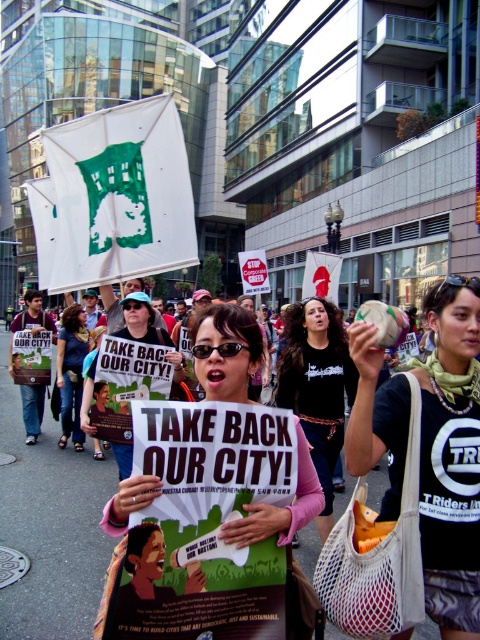
Which is above, black cotton shirt at center or matte black sign at center?

matte black sign at center is above.

Between point (291, 323) and point (95, 358), which one is positioned behind?

Point (95, 358)

Which is behind, point (280, 374) or point (122, 333)?

Positioned behind is point (122, 333).

At what (x,y) coordinates should I click in order to perform the action: click on black cotton shirt at center. Please return your answer as a coordinate pair (x, y). This screenshot has height=640, width=480. Looking at the image, I should click on (316, 387).

Who is higher up, black mesh bag at center or pink fabric shirt at center?

black mesh bag at center is higher up.

Which is in front, point (431, 540) or point (139, 481)?

Point (139, 481) is in front.

Find the location of a particular element. This screenshot has height=640, width=480. black mesh bag at center is located at coordinates (451, 458).

Does black mesh bag at center appear on the right side of matte black sign at center?

Indeed, black mesh bag at center is positioned on the right side of matte black sign at center.

Can you confirm if black mesh bag at center is taller than matte black sign at center?

Yes.

Is point (432, 422) closer to camera compared to point (165, 340)?

Yes, point (432, 422) is in front of point (165, 340).

This screenshot has width=480, height=640. I want to click on black mesh bag at center, so pos(451,458).